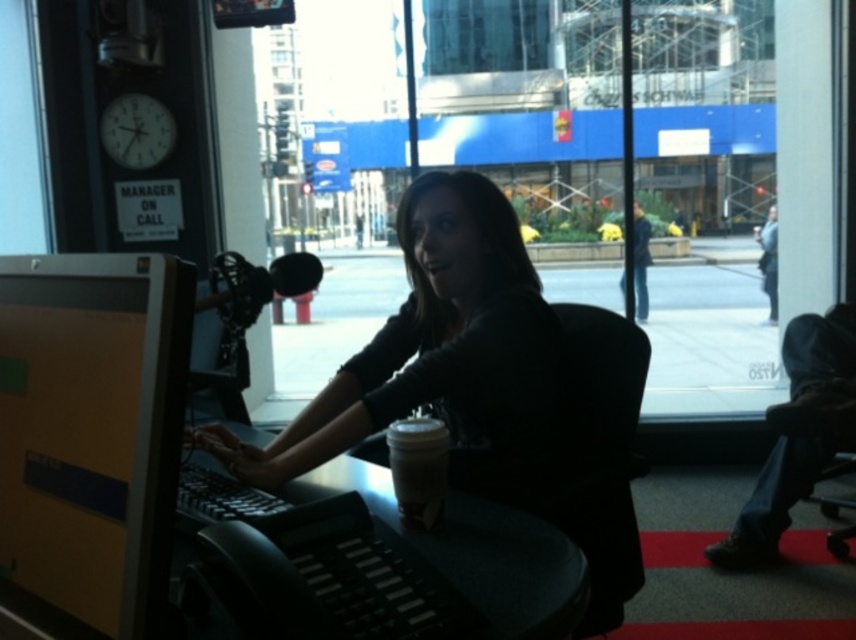
Does matte yellow monitor at center-left have a lesser width compared to white paper cup at center?

No, matte yellow monitor at center-left is not thinner than white paper cup at center.

This screenshot has width=856, height=640. What do you see at coordinates (92, 429) in the screenshot? I see `matte yellow monitor at center-left` at bounding box center [92, 429].

Does point (27, 422) come closer to viewer compared to point (435, 468)?

Yes, it is.

Locate an element on the screen. The width and height of the screenshot is (856, 640). matte yellow monitor at center-left is located at coordinates (92, 429).

Is point (74, 525) positioned after point (621, 275)?

That is False.

Which is in front, point (153, 556) or point (638, 278)?

Point (153, 556) is in front.

Which is in front, point (56, 376) or point (646, 296)?

Point (56, 376) is more forward.

Find the location of a particular element. The width and height of the screenshot is (856, 640). matte yellow monitor at center-left is located at coordinates (92, 429).

Is matte yellow monitor at center-left closer to the viewer compared to matte black shirt at center?

Yes, matte yellow monitor at center-left is closer to the viewer.

Between matte yellow monitor at center-left and matte black shirt at center, which one appears on the right side from the viewer's perspective?

matte black shirt at center is more to the right.

You are a GUI agent. You are given a task and a screenshot of the screen. Output one action in this format:
    pyautogui.click(x=<x>, y=<y>)
    Task: Click on the matte yellow monitor at center-left
    This screenshot has height=640, width=856.
    Given the screenshot: What is the action you would take?
    pyautogui.click(x=92, y=429)